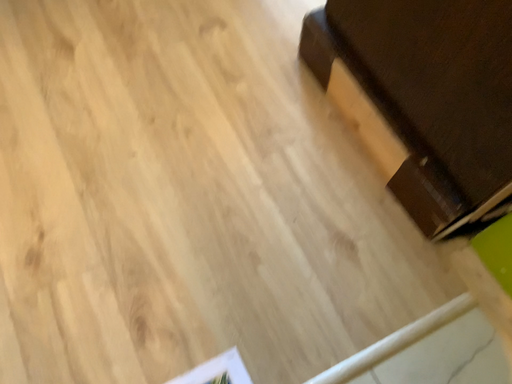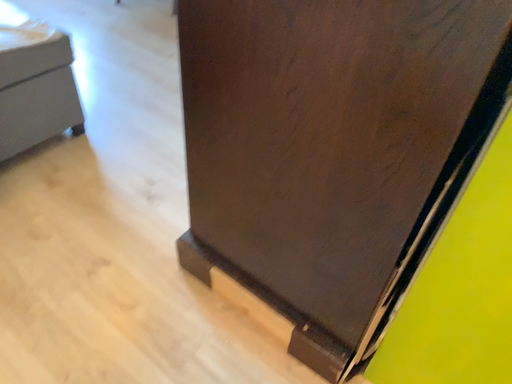
Question: How did the camera likely rotate when shooting the video?

Choices:
 (A) rotated right
 (B) rotated left

Answer: (A)